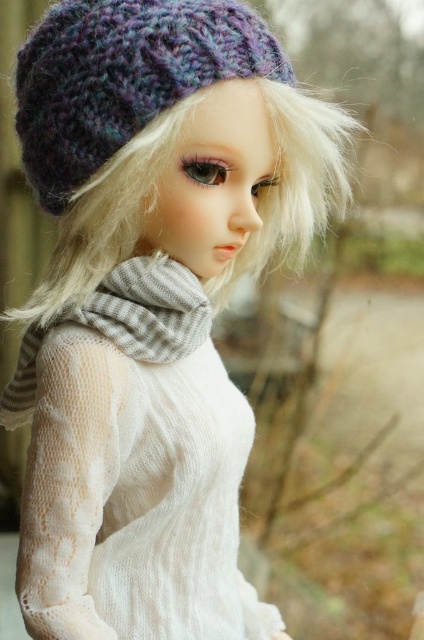
Can you confirm if white knitted dress at center is positioned to the right of purple knitted hat at upper center?

No, white knitted dress at center is not to the right of purple knitted hat at upper center.

Can you confirm if white knitted dress at center is smaller than purple knitted hat at upper center?

Incorrect, white knitted dress at center is not smaller in size than purple knitted hat at upper center.

Between point (128, 486) and point (86, 172), which one is positioned in front?

Positioned in front is point (86, 172).

Image resolution: width=424 pixels, height=640 pixels. I want to click on white knitted dress at center, so click(133, 468).

Who is lower down, white knitted dress at center or gray striped scarf at center?

Positioned lower is white knitted dress at center.

Is point (195, 492) less distant than point (13, 378)?

Yes, point (195, 492) is closer to viewer.

Between point (31, 532) and point (94, 296), which one is positioned in front?

Point (31, 532)

Locate an element on the screen. This screenshot has height=640, width=424. white knitted dress at center is located at coordinates (x=133, y=468).

Who is more distant from viewer, (189, 88) or (189, 339)?

Point (189, 339)

Which is above, purple knitted hat at upper center or gray striped scarf at center?

purple knitted hat at upper center is above.

Does point (234, 42) lie behind point (169, 310)?

That is False.

Locate an element on the screen. The image size is (424, 640). purple knitted hat at upper center is located at coordinates (123, 76).